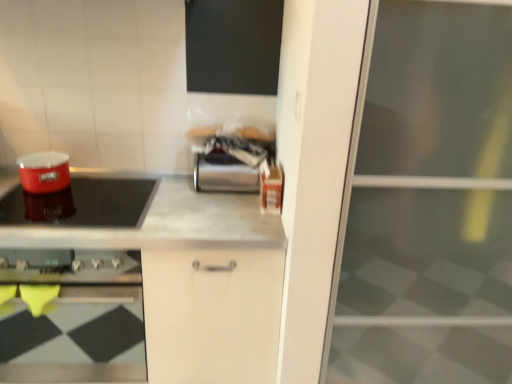
Question: From a real-world perspective, does shiny red pot at left sit lower than metallic gray countertop at center?

Choices:
 (A) yes
 (B) no

Answer: (B)

Question: Does shiny red pot at left have a lesser width compared to metallic gray countertop at center?

Choices:
 (A) no
 (B) yes

Answer: (B)

Question: Is metallic gray countertop at center a part of shiny red pot at left?

Choices:
 (A) no
 (B) yes

Answer: (A)

Question: Is shiny red pot at left closer to camera compared to metallic gray countertop at center?

Choices:
 (A) no
 (B) yes

Answer: (A)

Question: Is shiny red pot at left outside of metallic gray countertop at center?

Choices:
 (A) no
 (B) yes

Answer: (A)

Question: Is shiny red pot at left wider than metallic gray countertop at center?

Choices:
 (A) no
 (B) yes

Answer: (A)

Question: Can you confirm if shiny red pot at left is positioned to the right of satin silver canister at center, which is the 1th appliance from right to left?

Choices:
 (A) yes
 (B) no

Answer: (B)

Question: Considering the relative sizes of shiny red pot at left and satin silver canister at center, which ranks as the 2th appliance in left-to-right order, in the image provided, is shiny red pot at left smaller than satin silver canister at center, which ranks as the 2th appliance in left-to-right order,?

Choices:
 (A) yes
 (B) no

Answer: (A)

Question: Is shiny red pot at left touching satin silver canister at center, which is the 1th appliance from right to left?

Choices:
 (A) no
 (B) yes

Answer: (A)

Question: Are shiny red pot at left and satin silver canister at center, which is the 1th appliance from right to left, located far from each other?

Choices:
 (A) yes
 (B) no

Answer: (B)

Question: Can you confirm if shiny red pot at left is bigger than satin silver canister at center, which ranks as the 2th appliance in left-to-right order?

Choices:
 (A) yes
 (B) no

Answer: (B)

Question: From the image's perspective, would you say shiny red pot at left is positioned over satin silver canister at center, which ranks as the 2th appliance in left-to-right order?

Choices:
 (A) no
 (B) yes

Answer: (A)

Question: Is transparent glass screen door at right directly adjacent to metallic gray countertop at center?

Choices:
 (A) yes
 (B) no

Answer: (B)